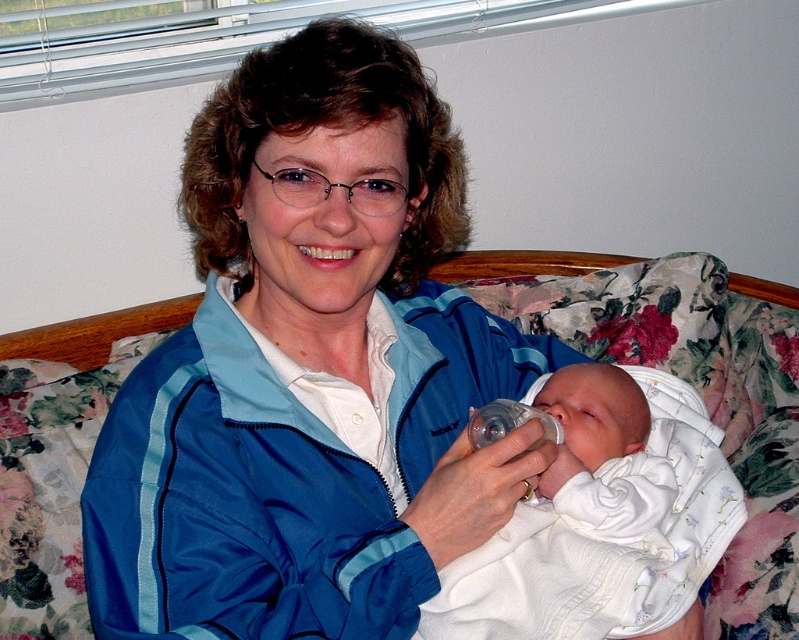
Question: Which point is closer to the camera?

Choices:
 (A) (100, 461)
 (B) (507, 554)

Answer: (A)

Question: Does blue nylon jacket at center appear on the left side of white soft cloth at center?

Choices:
 (A) no
 (B) yes

Answer: (B)

Question: Can you confirm if blue nylon jacket at center is bigger than white soft cloth at center?

Choices:
 (A) yes
 (B) no

Answer: (A)

Question: Is blue nylon jacket at center bigger than white soft cloth at center?

Choices:
 (A) no
 (B) yes

Answer: (B)